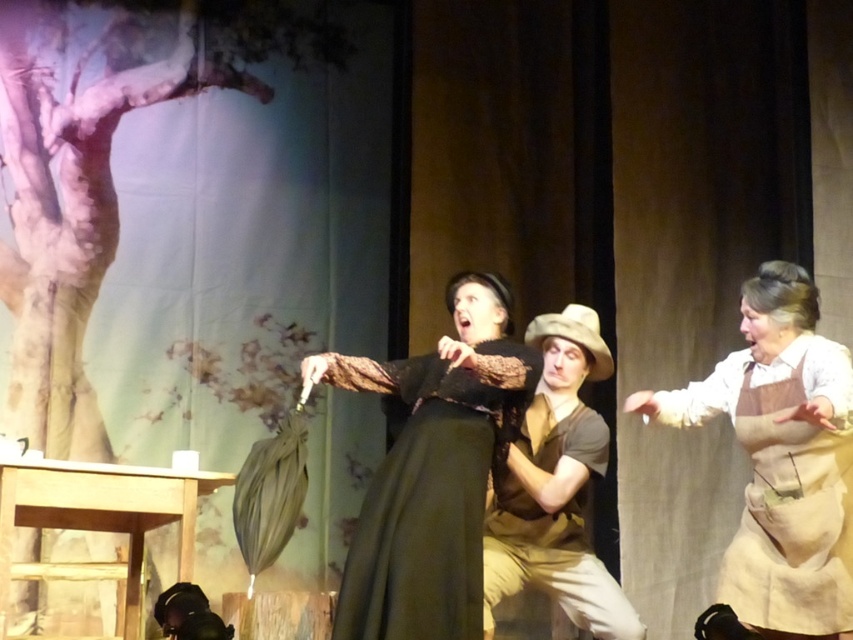
Question: Does matte black dress at center appear on the right side of brown cotton apron at center?

Choices:
 (A) yes
 (B) no

Answer: (B)

Question: Is matte black dress at center thinner than brown cotton shirt at center?

Choices:
 (A) yes
 (B) no

Answer: (B)

Question: Which point is farther to the camera?

Choices:
 (A) pos(469,339)
 (B) pos(830,532)

Answer: (A)

Question: Is matte black dress at center to the right of brown cotton shirt at center from the viewer's perspective?

Choices:
 (A) no
 (B) yes

Answer: (A)

Question: Which is nearer to the brown cotton shirt at center?

Choices:
 (A) brown cotton apron at center
 (B) matte black dress at center

Answer: (B)

Question: Which object is the farthest from the brown cotton shirt at center?

Choices:
 (A) brown cotton apron at center
 (B) matte black dress at center

Answer: (A)